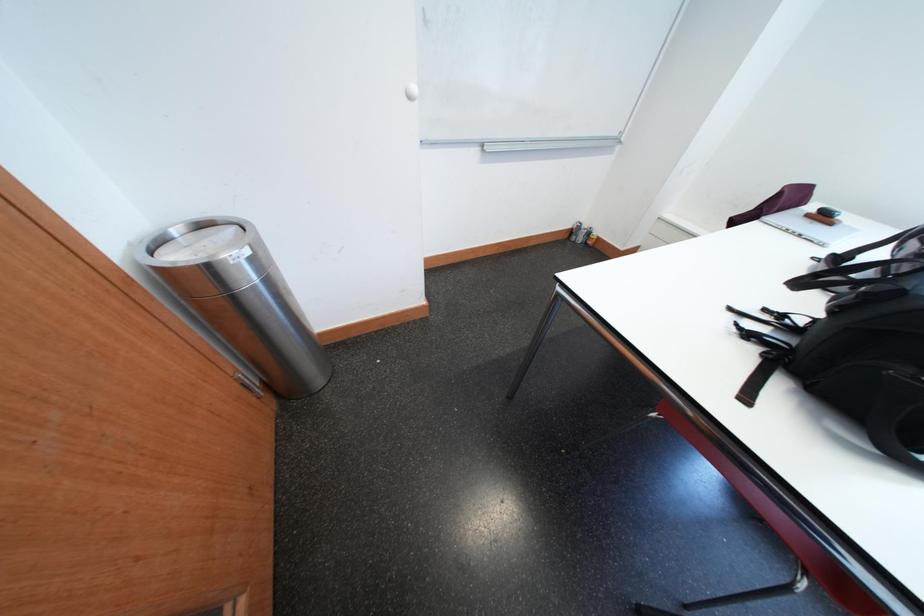
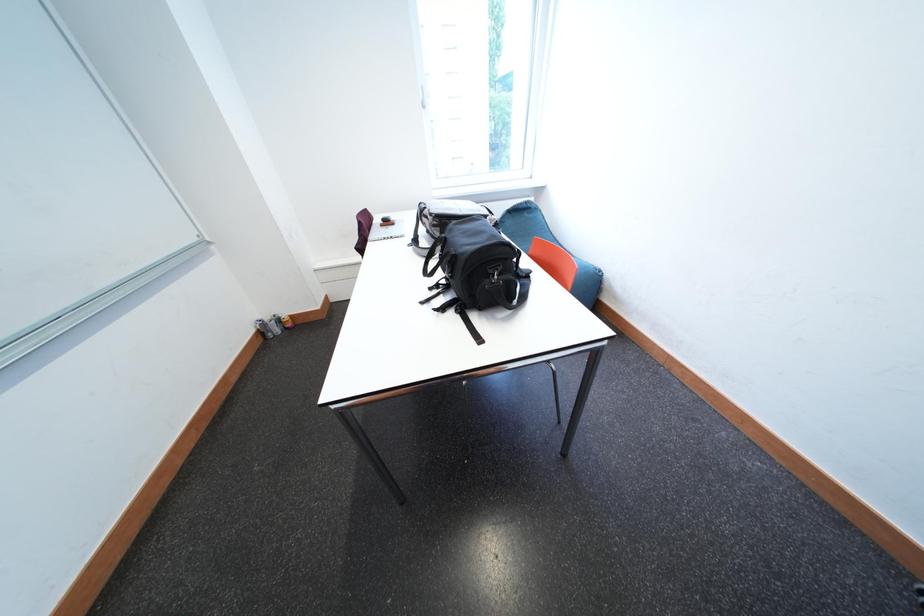
First-person continuous shooting, in which direction is the camera rotating?

The rotation direction of the camera is right-down.